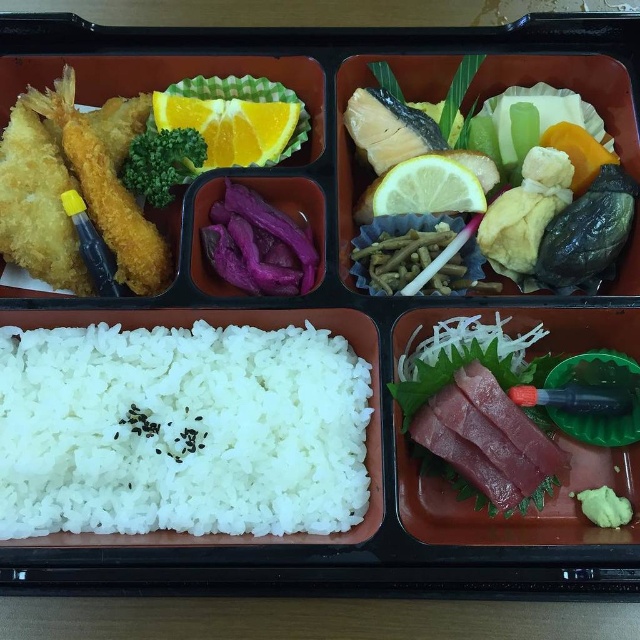
Question: Estimate the real-world distances between objects in this image. Which object is farther from the orange matte lemon at upper center?

Choices:
 (A) shiny silver fish at upper right
 (B) sliced pinkish raw fish at bottom right
 (C) yellow matte lemon at center

Answer: (B)

Question: Among these points, which one is farthest from the camera?

Choices:
 (A) (397, 195)
 (B) (198, 112)
 (C) (397, 371)

Answer: (B)

Question: Does sliced pinkish raw fish at bottom right have a greater width compared to orange matte lemon at upper center?

Choices:
 (A) no
 (B) yes

Answer: (B)

Question: Does white matte rice at center have a lesser width compared to yellow matte lemon at center?

Choices:
 (A) yes
 (B) no

Answer: (B)

Question: Which object is the closest to the purple matte pickled radish at center?

Choices:
 (A) orange matte lemon at upper center
 (B) shiny silver fish at upper right

Answer: (A)

Question: Is white matte rice at center closer to the viewer compared to purple matte pickled radish at center?

Choices:
 (A) no
 (B) yes

Answer: (B)